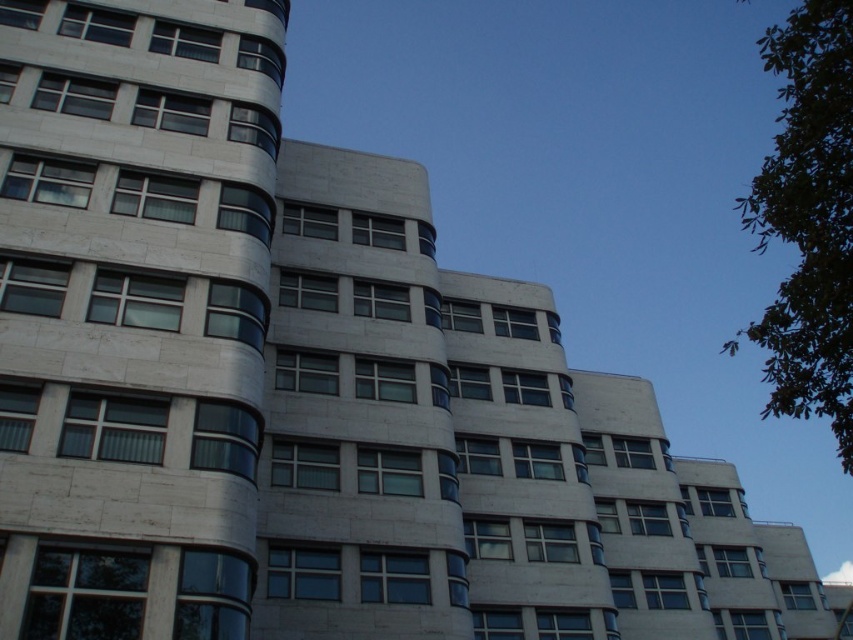
You are standing in a public square and see the white marble building at center. If you want to take a photo of it from a distance where it appears small but still recognizable, would 21.42 meters be a suitable distance?

The white marble building at center is 21.42 meters away from viewer, so yes, this distance would allow the building to appear small but still recognizable in the photo.

You are standing in front of the white marble building at center and want to take a photo of the green leafy tree at upper right. Which direction should you turn to face the tree?

The white marble building at center is to the left of the green leafy tree at upper right, so you should turn to your right to face the tree.

You are standing at the base of the white marble building at center and want to walk to the green leafy tree at upper right. Given that the distance between them is 58.85 meters, how many steps would you need to take if each step covers approximately 0.75 meters?

The distance between the white marble building at center and the green leafy tree at upper right is 58.85 meters. Since each step covers about 0.75 meters, you would need approximately 58.85 divided by 0.75, which equals roughly 78.47 steps. Therefore, you would need around 78 to 79 steps to reach the tree.